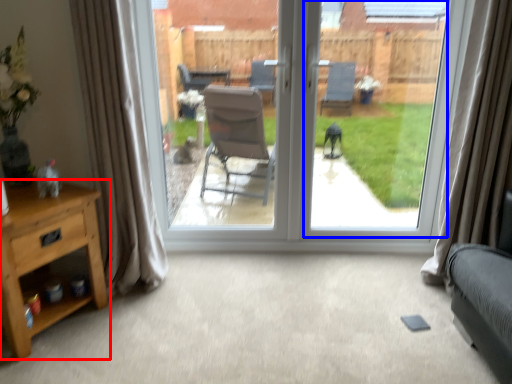
Question: Which of the following is the closest to the observer, nightstand (highlighted by a red box) or window screen (highlighted by a blue box)?

Choices:
 (A) nightstand
 (B) window screen

Answer: (A)